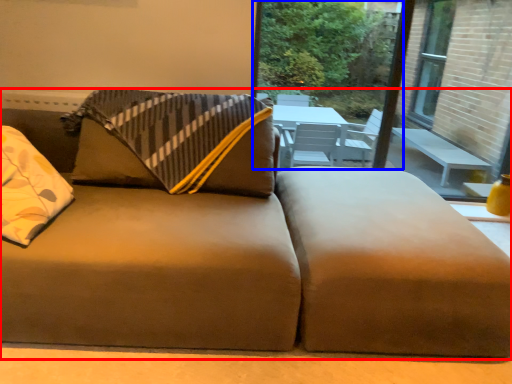
Question: Which of the following is the closest to the observer, studio couch (highlighted by a red box) or window screen (highlighted by a blue box)?

Choices:
 (A) studio couch
 (B) window screen

Answer: (A)